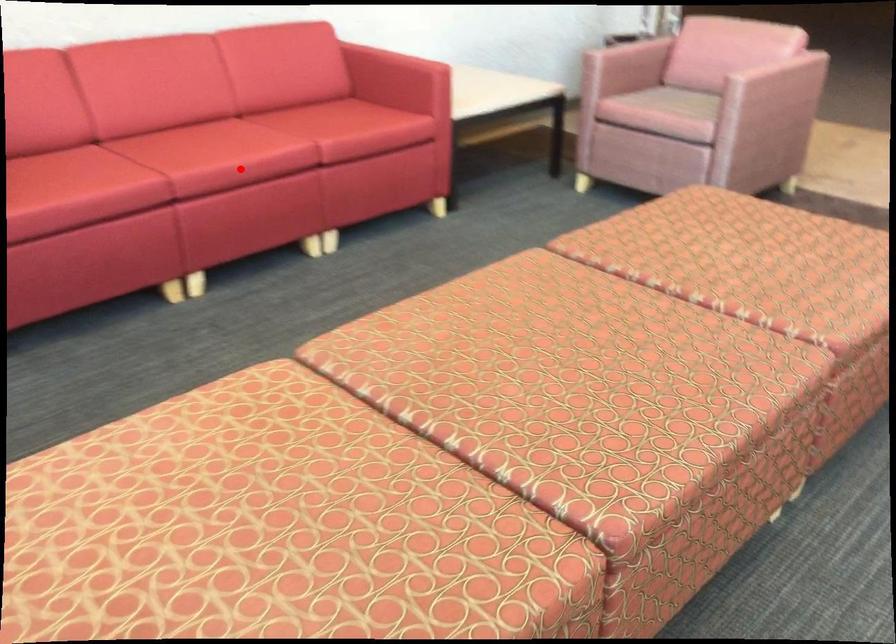
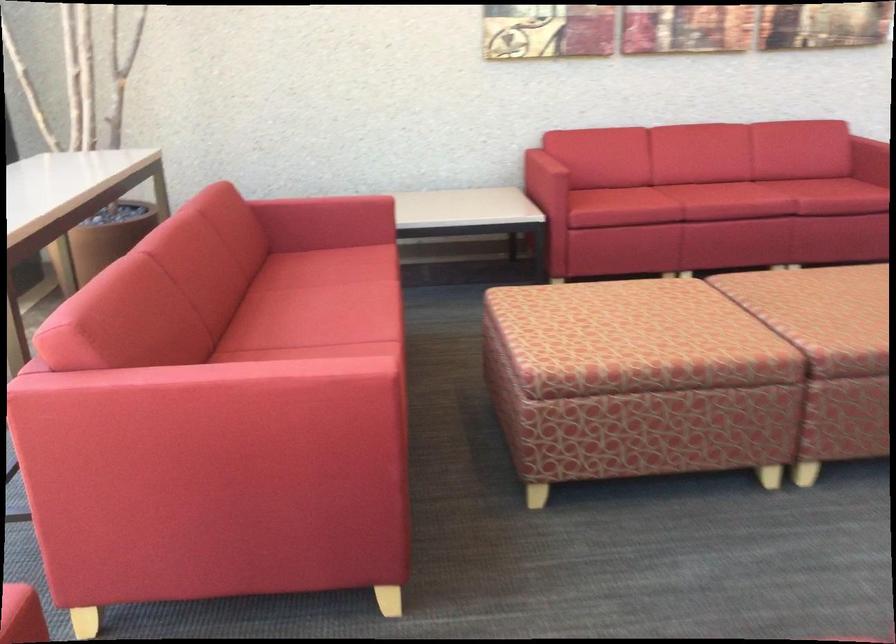
Question: I am providing you with two images of the same scene from different viewpoints. Given a red point in image1, look at the same physical point in image2. Is it:

Choices:
 (A) Closer to the viewpoint
 (B) Farther from the viewpoint

Answer: (B)